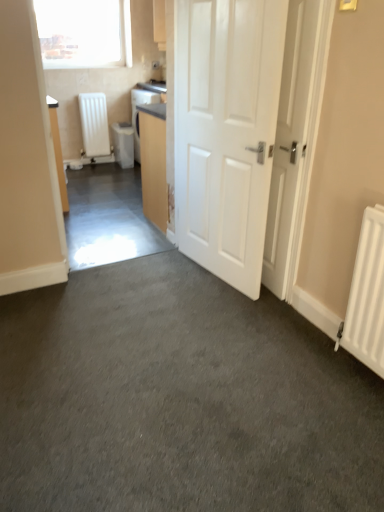
Question: Is white glossy door at center, the 2th door when ordered from right to left, completely or partially inside white matte door at center, marked as the 2th door in a left-to-right arrangement?

Choices:
 (A) yes
 (B) no

Answer: (B)

Question: Does white matte door at center, which appears as the 1th door when viewed from the right, have a greater width compared to white glossy door at center, which is counted as the 1th door, starting from the left?

Choices:
 (A) no
 (B) yes

Answer: (A)

Question: Is white matte door at center, marked as the 2th door in a left-to-right arrangement, to the left of white glossy door at center, which is counted as the 1th door, starting from the left, from the viewer's perspective?

Choices:
 (A) no
 (B) yes

Answer: (A)

Question: From the image's perspective, would you say white matte door at center, marked as the 2th door in a left-to-right arrangement, is shown under white glossy door at center, the 2th door when ordered from right to left?

Choices:
 (A) yes
 (B) no

Answer: (A)

Question: Is white glossy door at center, which is counted as the 1th door, starting from the left, at the back of white matte door at center, which appears as the 1th door when viewed from the right?

Choices:
 (A) yes
 (B) no

Answer: (B)

Question: In terms of size, does matte wood cabinet at center appear bigger or smaller than white matte radiator at left, positioned as the second water heater in right-to-left order?

Choices:
 (A) big
 (B) small

Answer: (A)

Question: In terms of height, does matte wood cabinet at center look taller or shorter compared to white matte radiator at left, positioned as the second water heater in right-to-left order?

Choices:
 (A) tall
 (B) short

Answer: (A)

Question: In the image, is matte wood cabinet at center positioned in front of or behind white matte radiator at left, which appears as the first water heater when viewed from the left?

Choices:
 (A) front
 (B) behind

Answer: (A)

Question: Is matte wood cabinet at center situated inside white matte radiator at left, positioned as the second water heater in right-to-left order, or outside?

Choices:
 (A) outside
 (B) inside

Answer: (A)

Question: From a real-world perspective, is white matte radiator at left, which appears as the first water heater when viewed from the left, positioned above or below transparent glass window at upper left?

Choices:
 (A) above
 (B) below

Answer: (B)

Question: From the image's perspective, is white matte radiator at left, positioned as the second water heater in right-to-left order, above or below transparent glass window at upper left?

Choices:
 (A) above
 (B) below

Answer: (B)

Question: Does point (99, 138) appear closer or farther from the camera than point (84, 22)?

Choices:
 (A) closer
 (B) farther

Answer: (B)

Question: In the image, is white matte radiator at left, which appears as the first water heater when viewed from the left, positioned in front of or behind transparent glass window at upper left?

Choices:
 (A) behind
 (B) front

Answer: (A)

Question: From the image's perspective, is matte wood cabinet at center above or below white plastic water heater at center-left, which is counted as the 1th water heater, starting from the right?

Choices:
 (A) above
 (B) below

Answer: (B)

Question: Does point (144, 168) appear closer or farther from the camera than point (127, 138)?

Choices:
 (A) farther
 (B) closer

Answer: (B)